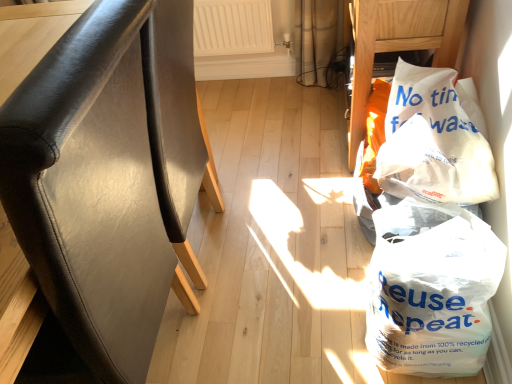
Question: Is white plastic bag at lower right, the 2th plastic bag when ordered from top to bottom, in front of or behind white paper bag at right, which is the 2th plastic bag in bottom-to-top order, in the image?

Choices:
 (A) front
 (B) behind

Answer: (A)

Question: From a real-world perspective, relative to white paper bag at right, which appears as the first plastic bag when viewed from the top, is white plastic bag at lower right, marked as the 1th plastic bag in a bottom-to-top arrangement, vertically above or below?

Choices:
 (A) below
 (B) above

Answer: (A)

Question: Based on their relative distances, which object is farther from the white paper bag at upper right, which is the second furniture in front-to-back order?

Choices:
 (A) white paper bag at right, which is the 2th plastic bag in bottom-to-top order
 (B) black leather chair at left, the 2th furniture viewed from the top
 (C) white plastic bag at lower right, marked as the 1th plastic bag in a bottom-to-top arrangement

Answer: (B)

Question: Which is nearer to the black leather chair at left, the 2th furniture viewed from the top?

Choices:
 (A) white plastic bag at lower right, marked as the 1th plastic bag in a bottom-to-top arrangement
 (B) white paper bag at right, which is the 2th plastic bag in bottom-to-top order
 (C) white paper bag at upper right, which is the 2th furniture in left-to-right order

Answer: (A)